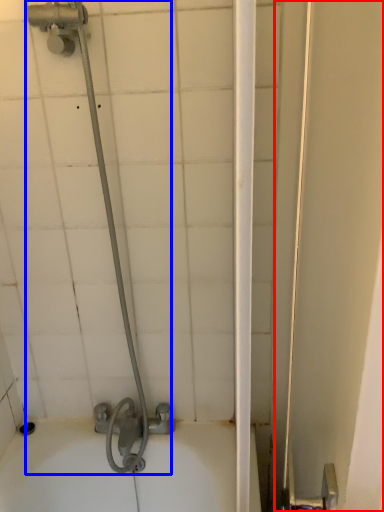
Question: Which of the following is the farthest to the observer, screen door (highlighted by a red box) or shower (highlighted by a blue box)?

Choices:
 (A) screen door
 (B) shower

Answer: (B)